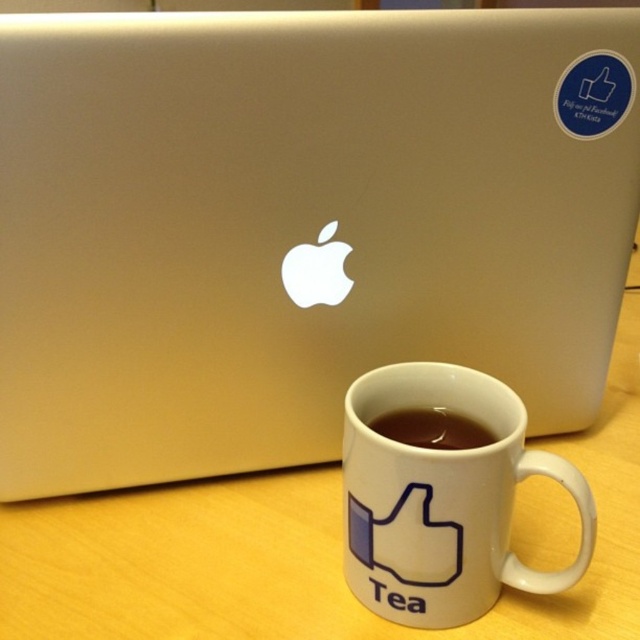
Who is higher up, white ceramic mug at lower center or brown matte coffee at center?

brown matte coffee at center

Does white ceramic mug at lower center appear over brown matte coffee at center?

Incorrect, white ceramic mug at lower center is not positioned above brown matte coffee at center.

Locate an element on the screen. The image size is (640, 640). white ceramic mug at lower center is located at coordinates (442, 499).

Where is `white ceramic mug at lower center`? white ceramic mug at lower center is located at coordinates (442, 499).